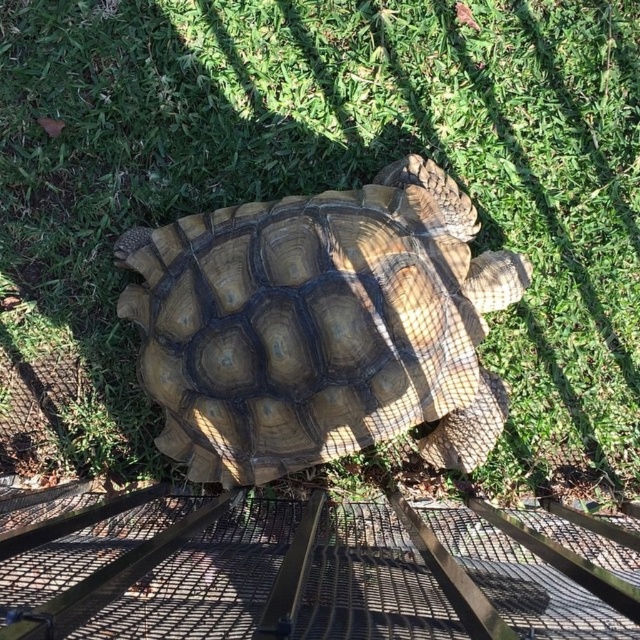
Question: Which object appears closest to the camera in this image?

Choices:
 (A) metal mesh fence at lower center
 (B) brown textured shell at center

Answer: (A)

Question: From the image, what is the correct spatial relationship of brown textured shell at center in relation to metal mesh fence at lower center?

Choices:
 (A) left
 (B) right

Answer: (A)

Question: Does brown textured shell at center appear over metal mesh fence at lower center?

Choices:
 (A) no
 (B) yes

Answer: (B)

Question: Is brown textured shell at center to the left of metal mesh fence at lower center from the viewer's perspective?

Choices:
 (A) no
 (B) yes

Answer: (B)

Question: Among these points, which one is nearest to the camera?

Choices:
 (A) (540, 612)
 (B) (368, 276)

Answer: (A)